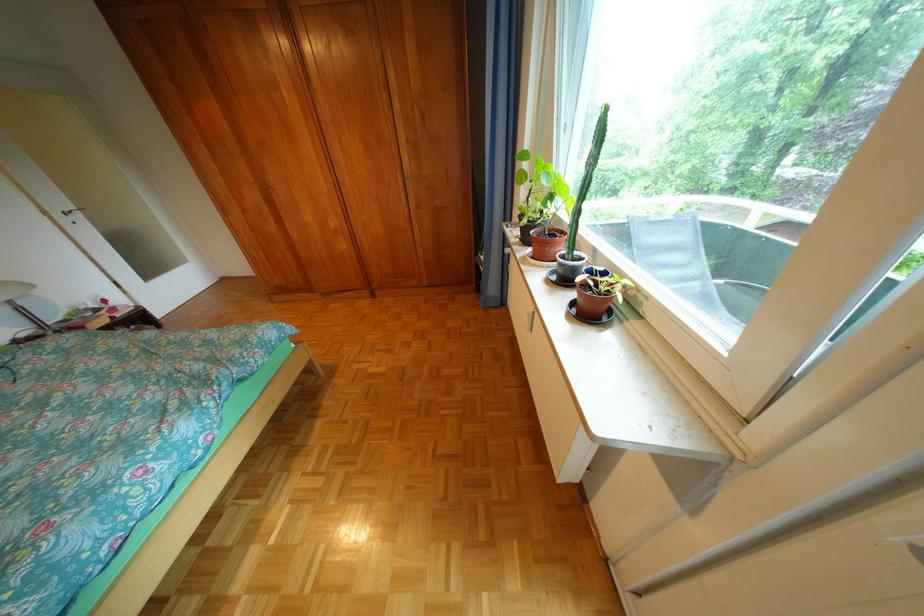
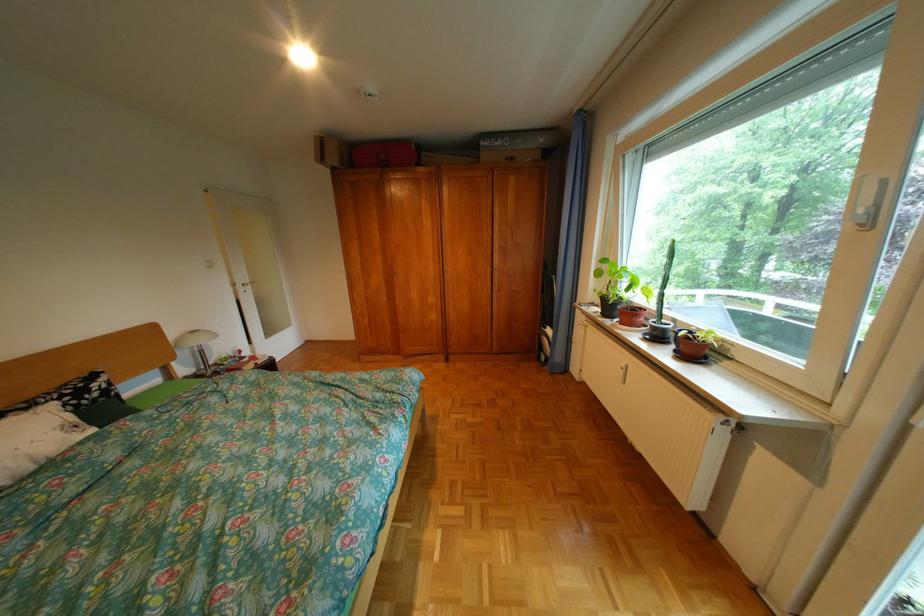
Where in the second image is the point corresponding to [62,214] from the first image?

(248, 285)